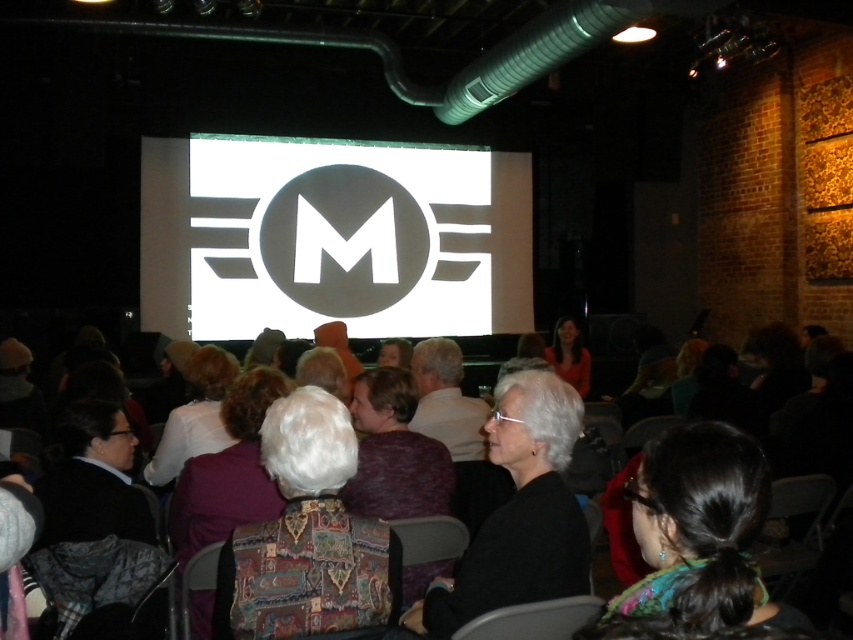
Does white sweater at center have a lesser width compared to smooth brown hair at center?

In fact, white sweater at center might be wider than smooth brown hair at center.

Is white sweater at center positioned at the back of smooth brown hair at center?

No, it is in front of smooth brown hair at center.

Locate an element on the screen. white sweater at center is located at coordinates click(195, 416).

The image size is (853, 640). I want to click on white sweater at center, so click(195, 416).

Between point (322, 548) and point (555, 362), which one is positioned behind?

Positioned behind is point (555, 362).

Can you confirm if patchwork sweater at center is wider than matte black jacket at center?

Incorrect, patchwork sweater at center's width does not surpass matte black jacket at center's.

What do you see at coordinates (306, 536) in the screenshot? I see `patchwork sweater at center` at bounding box center [306, 536].

Find the location of a particular element. The height and width of the screenshot is (640, 853). patchwork sweater at center is located at coordinates (306, 536).

Is point (70, 451) more distant than point (431, 376)?

No.

How much distance is there between dark gray sweater at lower left and white fabric at center?

They are 1.27 meters apart.

This screenshot has width=853, height=640. I want to click on dark gray sweater at lower left, so click(91, 480).